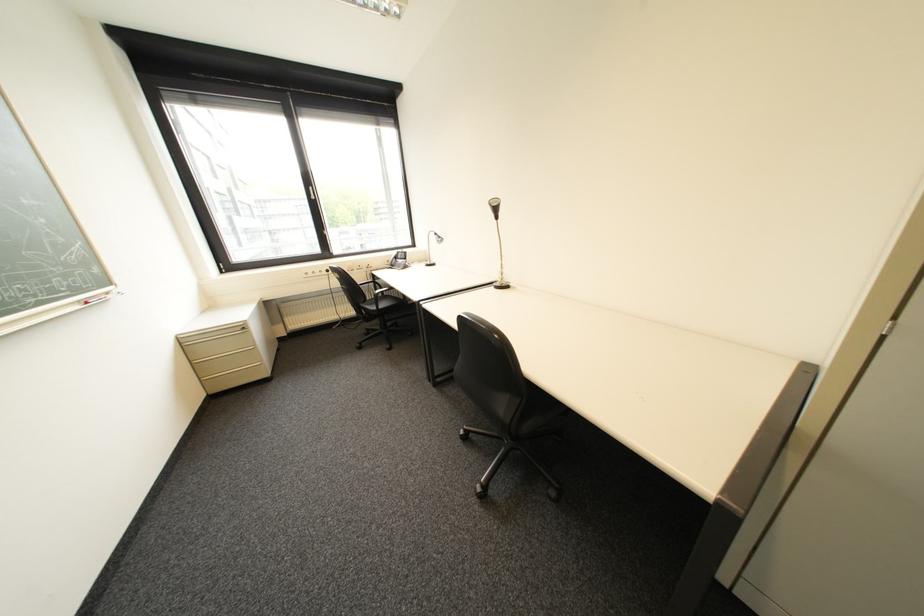
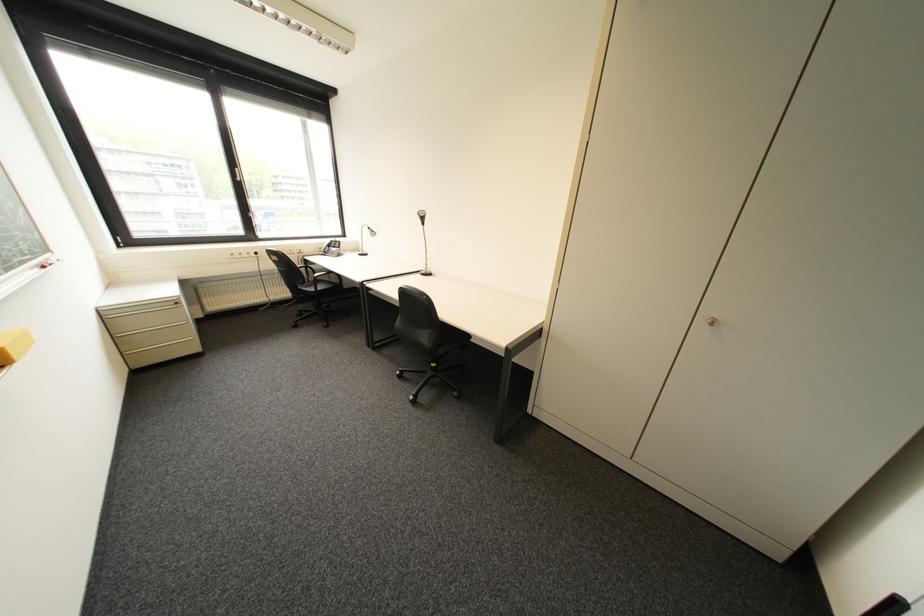
In the second image, find the point that corresponds to the point at 198,345 in the first image.

(119, 318)